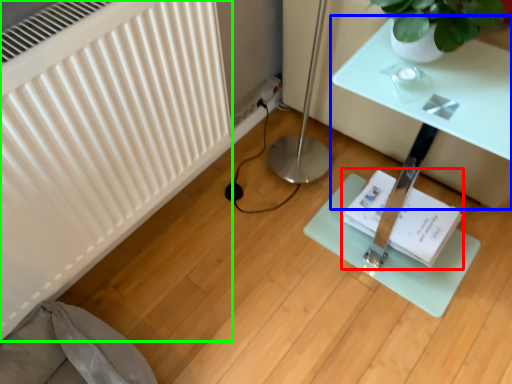
Question: Which object is the farthest from book (highlighted by a red box)? Choose among these: table (highlighted by a blue box) or radiator (highlighted by a green box).

Choices:
 (A) table
 (B) radiator

Answer: (B)